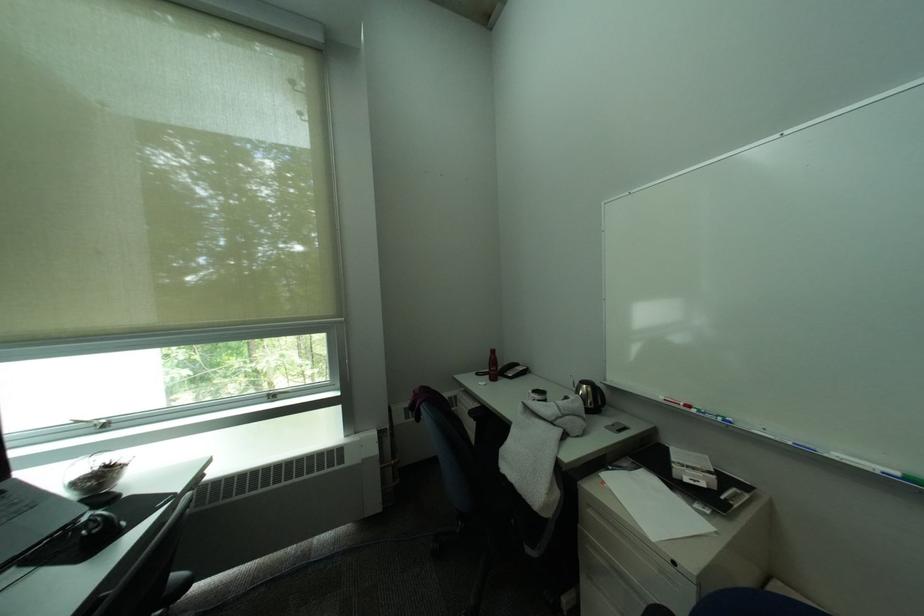
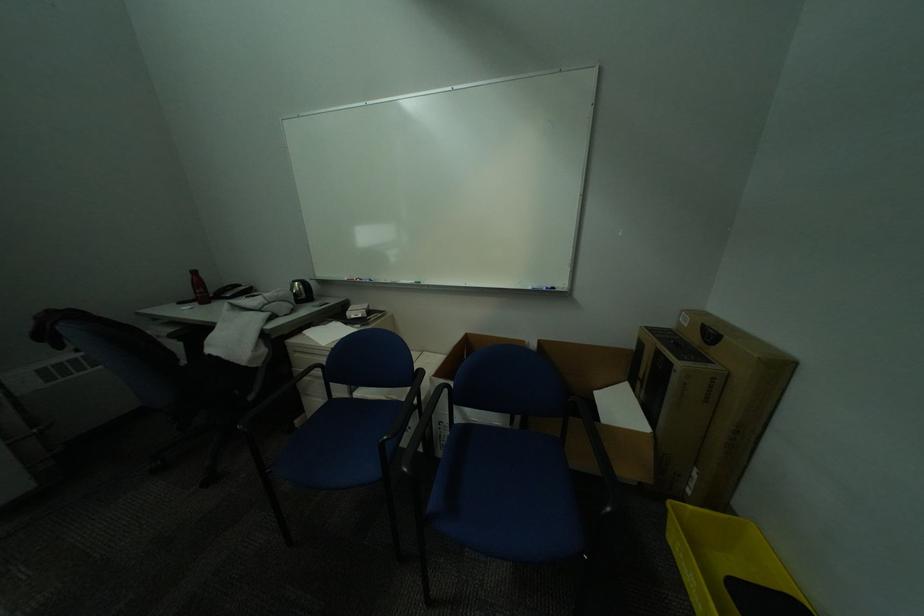
Where in the second image is the point corresponding to point (499, 379) from the first image?

(208, 304)